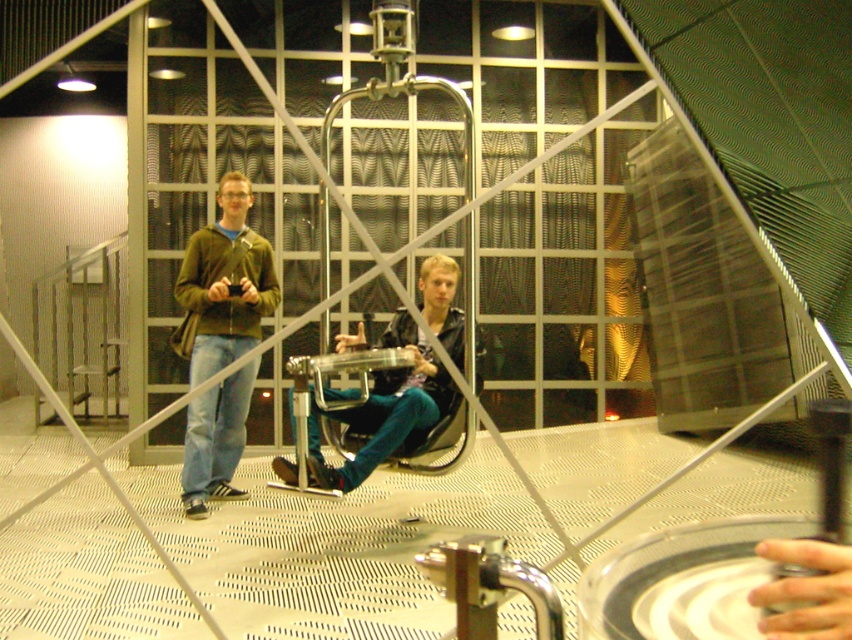
Question: Does green matte jacket at left have a greater width compared to blue denim jeans at center?

Choices:
 (A) no
 (B) yes

Answer: (A)

Question: Among these points, which one is farthest from the camera?

Choices:
 (A) (239, 493)
 (B) (358, 483)
 (C) (426, 419)
 (D) (237, 273)

Answer: (A)

Question: Which point is closer to the camera?

Choices:
 (A) teal denim jeans at center
 (B) green matte jacket at left

Answer: (A)

Question: Is green matte jacket at left below blue denim jeans at left?

Choices:
 (A) no
 (B) yes

Answer: (A)

Question: In this image, where is teal denim jeans at center located relative to blue denim jeans at center?

Choices:
 (A) above
 (B) below

Answer: (A)

Question: Among these objects, which one is nearest to the camera?

Choices:
 (A) green matte jacket at left
 (B) blue denim jeans at left
 (C) blue denim jeans at center

Answer: (C)